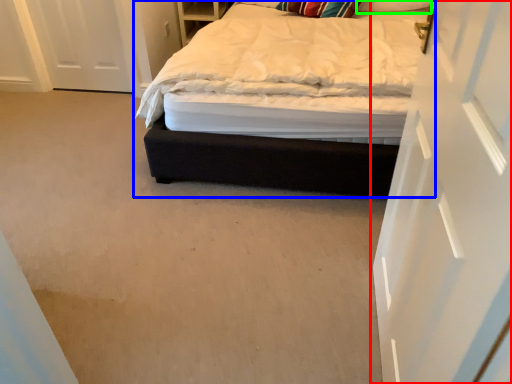
Question: Estimate the real-world distances between objects in this image. Which object is closer to door (highlighted by a red box), bed (highlighted by a blue box) or pillow (highlighted by a green box)?

Choices:
 (A) bed
 (B) pillow

Answer: (A)